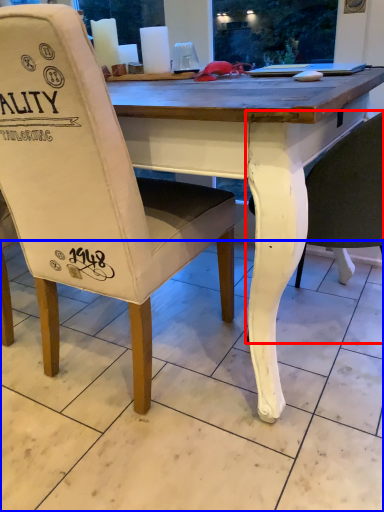
Question: Among these objects, which one is nearest to the camera, chair (highlighted by a red box) or tile (highlighted by a blue box)?

Choices:
 (A) chair
 (B) tile

Answer: (B)